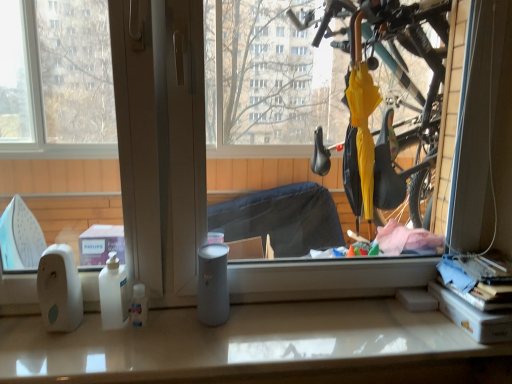
The height and width of the screenshot is (384, 512). In order to click on free point above white glossy counter top at lower center (from a real-world perspective) in this screenshot , I will do `click(252, 333)`.